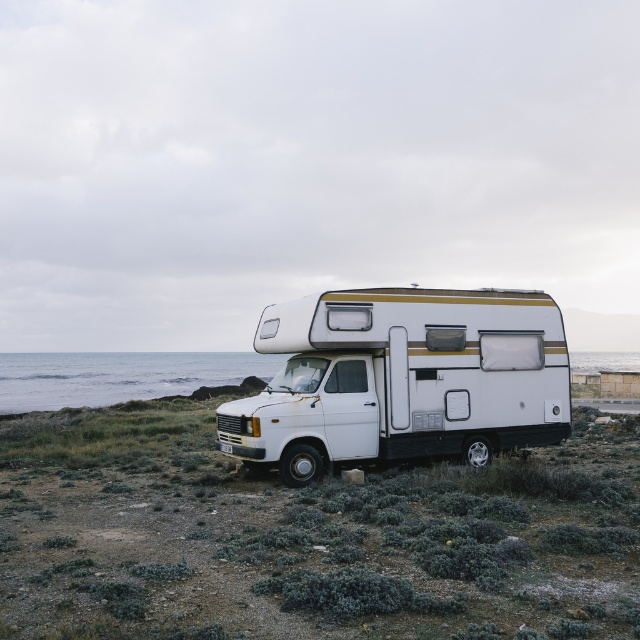
Is point (531, 390) positioned in front of point (81, 380)?

Yes, it is in front of point (81, 380).

From the picture: Can you confirm if white matte recreational vehicle at center is bigger than blue water at lower left?

No, white matte recreational vehicle at center is not bigger than blue water at lower left.

The image size is (640, 640). I want to click on white matte recreational vehicle at center, so click(403, 378).